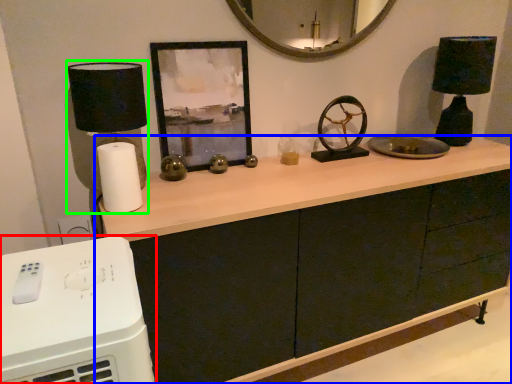
Question: Which is farther away from home appliance (highlighted by a red box)? cabinetry (highlighted by a blue box) or table lamp (highlighted by a green box)?

Choices:
 (A) cabinetry
 (B) table lamp

Answer: (A)